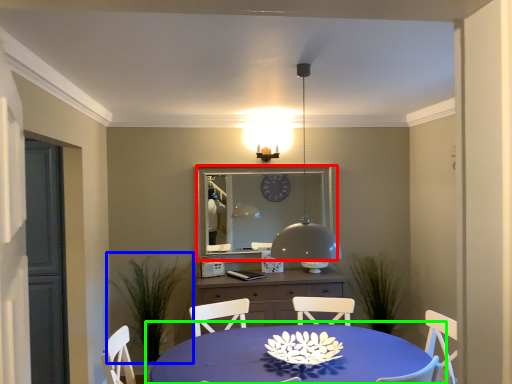
Question: Which is farther away from mirror (highlighted by a red box)? plant (highlighted by a blue box) or table (highlighted by a green box)?

Choices:
 (A) plant
 (B) table

Answer: (B)